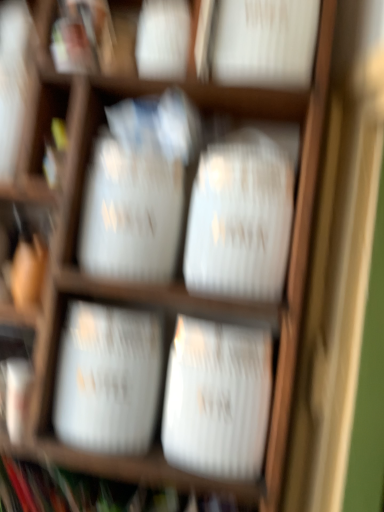
Question: Is white glossy vase at center, acting as the first wide starting from the bottom, at the right side of white paper bag at center, which ranks as the 1th wide in top-to-bottom order?

Choices:
 (A) no
 (B) yes

Answer: (A)

Question: From a real-world perspective, is white glossy vase at center, acting as the first wide starting from the bottom, on top of white paper bag at center, which ranks as the 1th wide in top-to-bottom order?

Choices:
 (A) yes
 (B) no

Answer: (B)

Question: Is white glossy vase at center, which is the 3th wide in top-to-bottom order, behind white paper bag at center, the third wide from the bottom?

Choices:
 (A) yes
 (B) no

Answer: (A)

Question: Are white glossy vase at center, acting as the first wide starting from the bottom, and white paper bag at center, which ranks as the 1th wide in top-to-bottom order, making contact?

Choices:
 (A) no
 (B) yes

Answer: (A)

Question: Is white glossy vase at center, acting as the first wide starting from the bottom, closer to camera compared to white paper bag at center, the third wide from the bottom?

Choices:
 (A) yes
 (B) no

Answer: (B)

Question: From the image's perspective, relative to white paper bag at center, the third wide from the bottom, is white glossy vase at center, which is the 3th wide in top-to-bottom order, above or below?

Choices:
 (A) above
 (B) below

Answer: (B)

Question: Is white glossy vase at center, which is the 3th wide in top-to-bottom order, bigger or smaller than white paper bag at center, which ranks as the 1th wide in top-to-bottom order?

Choices:
 (A) big
 (B) small

Answer: (B)

Question: Is white glossy vase at center, which is the 3th wide in top-to-bottom order, in front of or behind white paper bag at center, the third wide from the bottom, in the image?

Choices:
 (A) behind
 (B) front

Answer: (A)

Question: From a real-world perspective, is white glossy vase at center, acting as the first wide starting from the bottom, physically located above or below white paper bag at center, which ranks as the 1th wide in top-to-bottom order?

Choices:
 (A) above
 (B) below

Answer: (B)

Question: Do you think white glossy vase at center, acting as the first wide starting from the bottom, is within white glossy vase at center, which is the 2th wide from bottom to top, or outside of it?

Choices:
 (A) inside
 (B) outside

Answer: (B)

Question: Is white glossy vase at center, acting as the first wide starting from the bottom, wider or thinner than white glossy vase at center, which is the 2th wide from bottom to top?

Choices:
 (A) wide
 (B) thin

Answer: (A)

Question: Does point (244, 425) appear closer or farther from the camera than point (99, 407)?

Choices:
 (A) closer
 (B) farther

Answer: (A)

Question: From a real-world perspective, relative to white glossy vase at center, which ranks as the second wide in top-to-bottom order, is white glossy vase at center, which is the 3th wide in top-to-bottom order, vertically above or below?

Choices:
 (A) above
 (B) below

Answer: (A)

Question: Would you say white glossy vase at center, which ranks as the second wide in top-to-bottom order, is inside or outside white paper bag at center, which ranks as the 1th wide in top-to-bottom order?

Choices:
 (A) outside
 (B) inside

Answer: (A)

Question: From a real-world perspective, is white glossy vase at center, which ranks as the second wide in top-to-bottom order, physically located above or below white paper bag at center, the third wide from the bottom?

Choices:
 (A) below
 (B) above

Answer: (A)